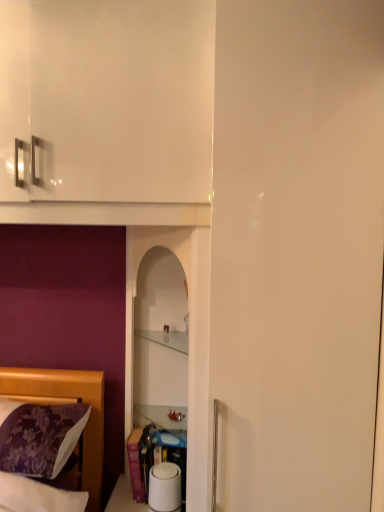
Question: Can you confirm if transparent glass shelf at center is thinner than clear glass cabinet at center?

Choices:
 (A) no
 (B) yes

Answer: (A)

Question: From a real-world perspective, is transparent glass shelf at center located beneath clear glass cabinet at center?

Choices:
 (A) yes
 (B) no

Answer: (A)

Question: Is transparent glass shelf at center directly adjacent to clear glass cabinet at center?

Choices:
 (A) yes
 (B) no

Answer: (B)

Question: Is transparent glass shelf at center facing towards clear glass cabinet at center?

Choices:
 (A) yes
 (B) no

Answer: (A)

Question: Is transparent glass shelf at center at the right side of clear glass cabinet at center?

Choices:
 (A) no
 (B) yes

Answer: (A)

Question: In terms of size, does purple floral fabric at lower left appear bigger or smaller than clear glass cabinet at center?

Choices:
 (A) big
 (B) small

Answer: (A)

Question: Is point (97, 411) positioned closer to the camera than point (134, 330)?

Choices:
 (A) closer
 (B) farther

Answer: (A)

Question: Is purple floral fabric at lower left taller or shorter than clear glass cabinet at center?

Choices:
 (A) short
 (B) tall

Answer: (B)

Question: Would you say purple floral fabric at lower left is inside or outside clear glass cabinet at center?

Choices:
 (A) inside
 (B) outside

Answer: (B)

Question: Considering the positions of transparent glass shelf at center and clear glass cabinet at center in the image, is transparent glass shelf at center wider or thinner than clear glass cabinet at center?

Choices:
 (A) wide
 (B) thin

Answer: (A)

Question: Considering the relative positions of transparent glass shelf at center and clear glass cabinet at center in the image provided, is transparent glass shelf at center to the left or to the right of clear glass cabinet at center?

Choices:
 (A) right
 (B) left

Answer: (B)

Question: Based on their sizes in the image, would you say transparent glass shelf at center is bigger or smaller than clear glass cabinet at center?

Choices:
 (A) small
 (B) big

Answer: (B)

Question: Relative to clear glass cabinet at center, is transparent glass shelf at center in front or behind?

Choices:
 (A) behind
 (B) front

Answer: (B)

Question: From the image's perspective, relative to transparent glass shelf at center, is clear glass cabinet at center above or below?

Choices:
 (A) above
 (B) below

Answer: (A)

Question: Is clear glass cabinet at center situated inside transparent glass shelf at center or outside?

Choices:
 (A) outside
 (B) inside

Answer: (B)